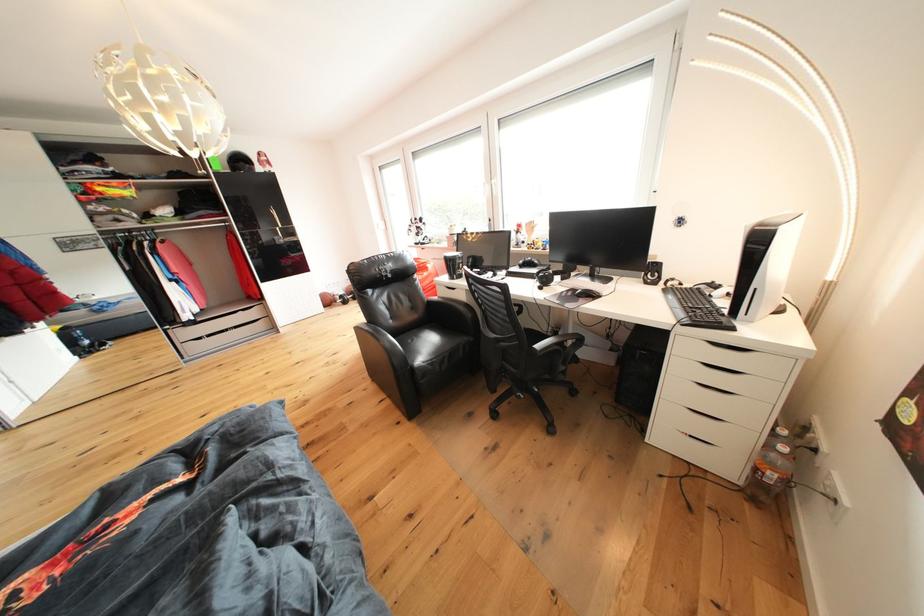
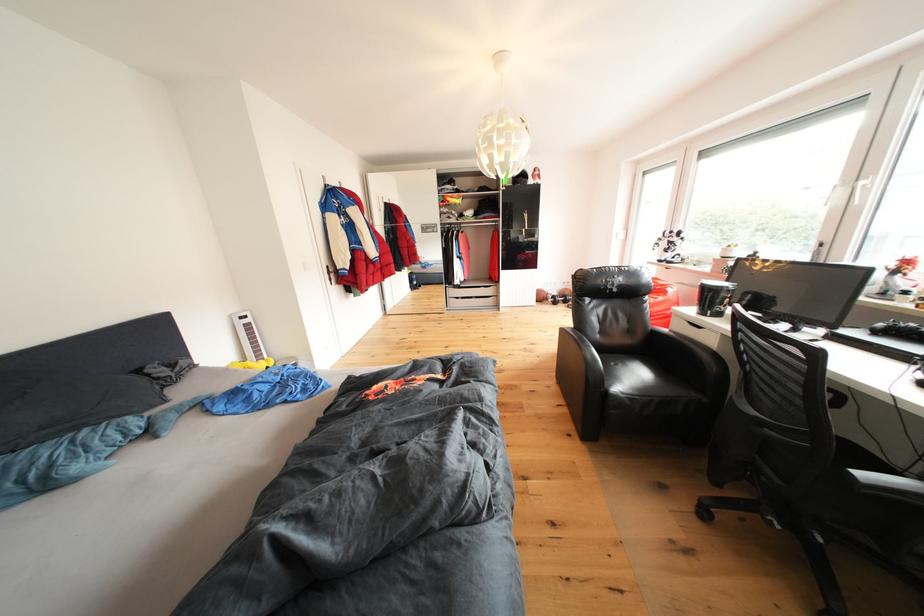
Where in the second image is the point corresponding to the point at 546,351 from the first image?

(872, 480)